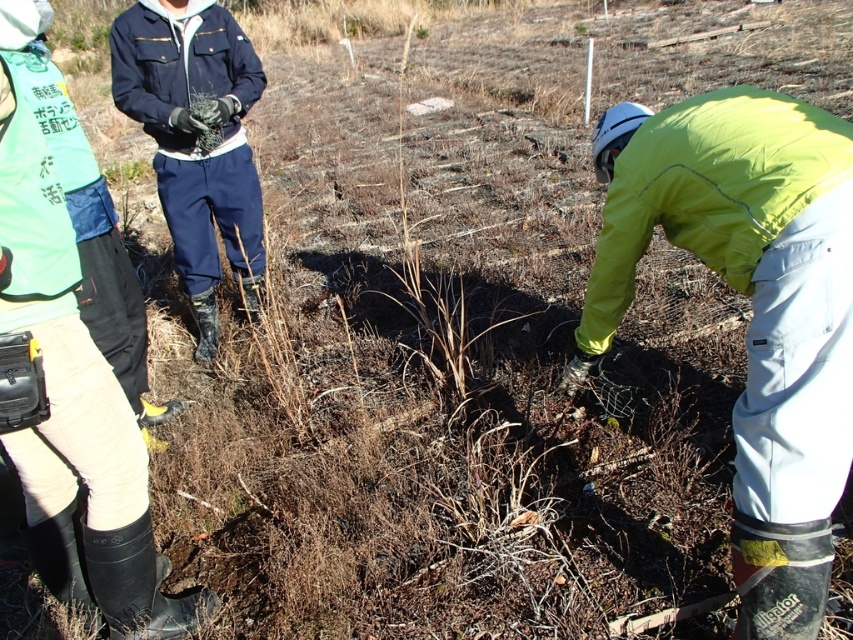
Can you confirm if matte black rubber boots at lower left is bigger than dark blue fabric jacket at upper left?

No, matte black rubber boots at lower left is not bigger than dark blue fabric jacket at upper left.

Can you confirm if matte black rubber boots at lower left is thinner than dark blue fabric jacket at upper left?

Indeed, matte black rubber boots at lower left has a lesser width compared to dark blue fabric jacket at upper left.

Which is behind, point (68, 529) or point (256, 76)?

Positioned behind is point (256, 76).

Locate an element on the screen. Image resolution: width=853 pixels, height=640 pixels. matte black rubber boots at lower left is located at coordinates (74, 413).

Can you confirm if neon yellow jacket at lower right is positioned below dark blue fabric jacket at upper left?

Yes.

Does point (717, 132) lie behind point (158, 81)?

No, it is in front of (158, 81).

Find the location of a particular element. Image resolution: width=853 pixels, height=640 pixels. neon yellow jacket at lower right is located at coordinates (752, 310).

Can you confirm if neon yellow jacket at lower right is smaller than matte black rubber boots at lower left?

No, neon yellow jacket at lower right is not smaller than matte black rubber boots at lower left.

Who is shorter, neon yellow jacket at lower right or matte black rubber boots at lower left?

neon yellow jacket at lower right is shorter.

Who is more distant from viewer, (782,440) or (65,534)?

Point (65,534)

You are a GUI agent. You are given a task and a screenshot of the screen. Output one action in this format:
    pyautogui.click(x=<x>, y=<y>)
    Task: Click on the neon yellow jacket at lower right
    
    Given the screenshot: What is the action you would take?
    [x=752, y=310]